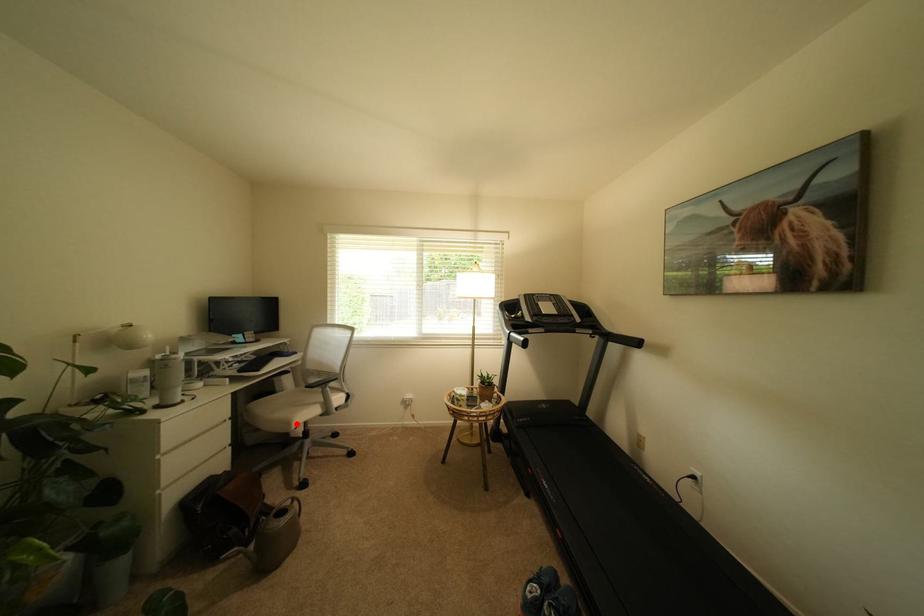
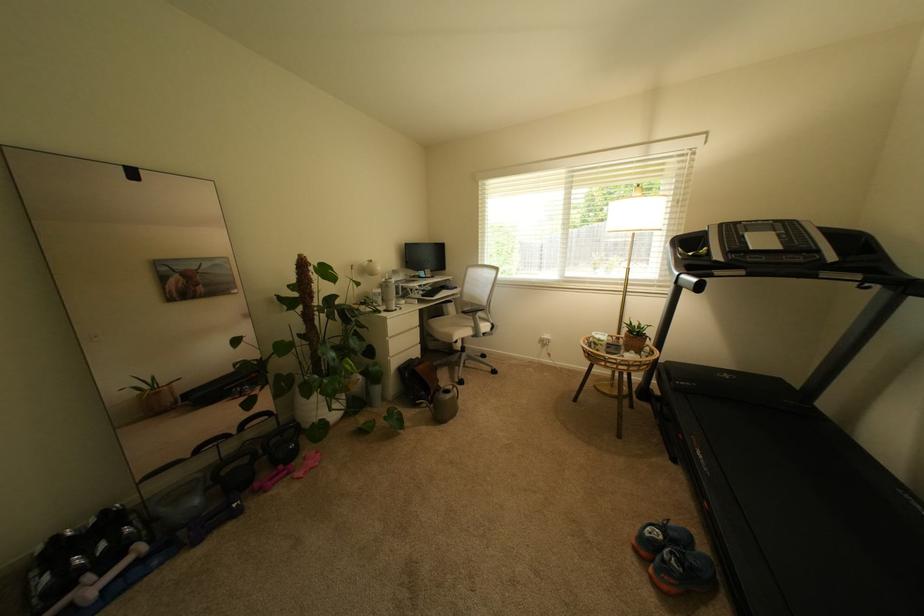
The point at the highlighted location is marked in the first image. Where is the corresponding point in the second image?

(459, 338)